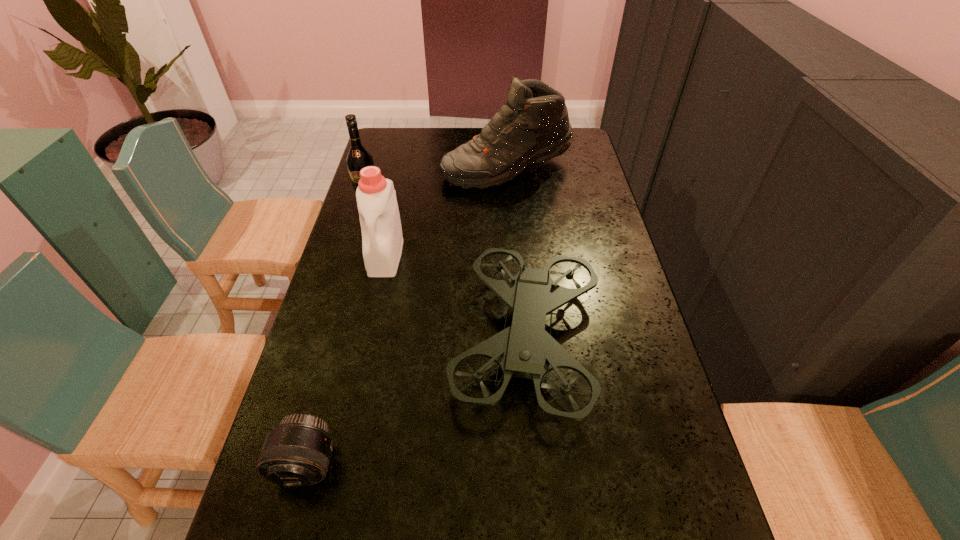
Identify the location of ski boot. (532, 127).

The width and height of the screenshot is (960, 540). What are the coordinates of `wine bottle` in the screenshot? It's located at (358, 157).

Identify the location of detergent. (382, 241).

Locate an element on the screen. This screenshot has width=960, height=540. the second shortest object is located at coordinates (525, 349).

Find the location of a particular element. The width and height of the screenshot is (960, 540). the nearest object is located at coordinates (297, 452).

Image resolution: width=960 pixels, height=540 pixels. Find the location of `the shortest object`. the shortest object is located at coordinates pyautogui.click(x=297, y=452).

At what (x,y) coordinates should I click in order to perform the action: click on free location located on the left of the farthest object. Please return your answer as a coordinate pair (x, y). Looking at the image, I should click on (372, 167).

Where is `vacant region located 0.050m on the label of the second farthest object`? vacant region located 0.050m on the label of the second farthest object is located at coordinates (363, 215).

Locate an element on the screen. The width and height of the screenshot is (960, 540). free region located on the handle side of the detergent is located at coordinates (376, 297).

Identify the location of free space located on the back of the drone. (515, 201).